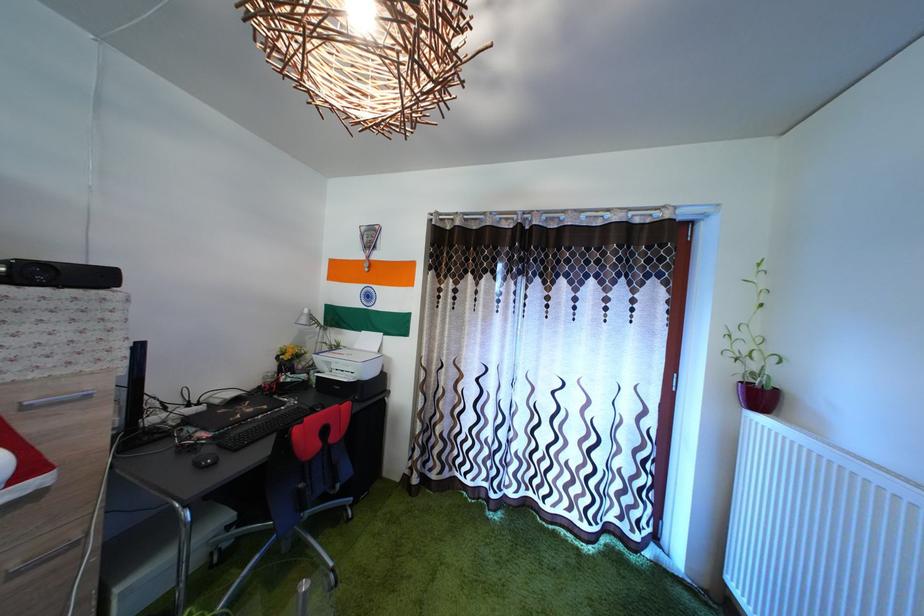
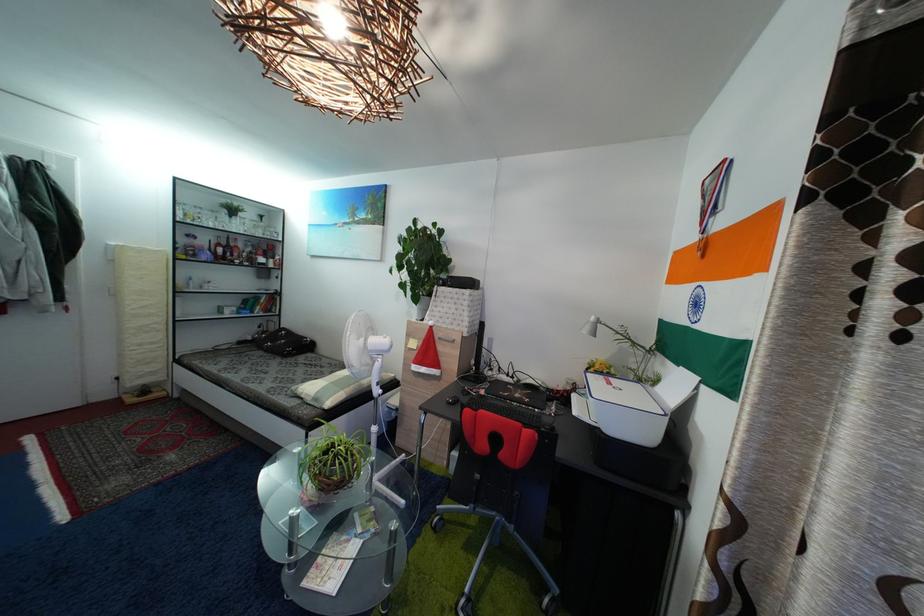
Where in the second image is the point corresponding to (x=286, y=363) from the first image?

(596, 377)